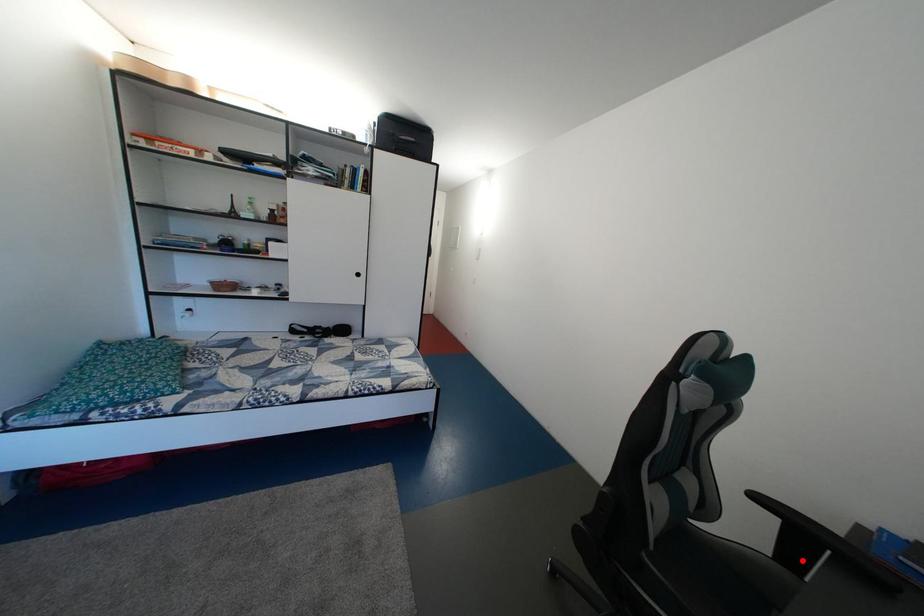
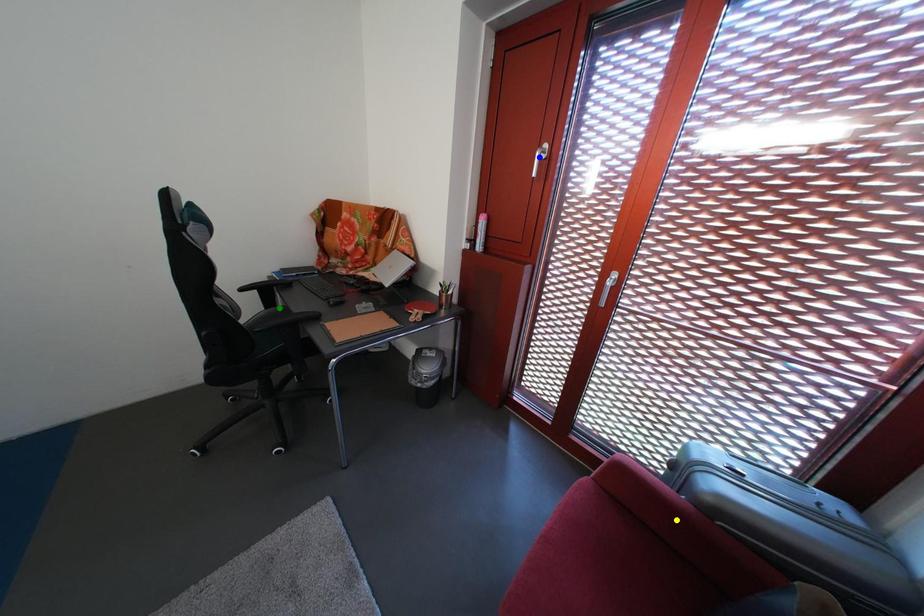
Question: I am providing you with two images of the same scene from different viewpoints. A red point is marked on the first image. You are given multiple points on the second image. Which spot in image 2 lines up with the point in image 1?

Choices:
 (A) green point
 (B) yellow point
 (C) blue point

Answer: (A)